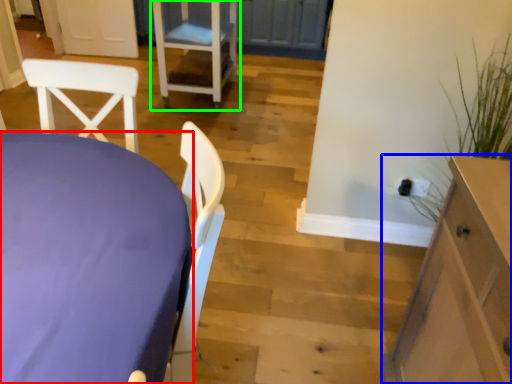
Question: Based on their relative distances, which object is nearer to table (highlighted by a red box)? Choose from cabinetry (highlighted by a blue box) and chair (highlighted by a green box).

Choices:
 (A) cabinetry
 (B) chair

Answer: (A)